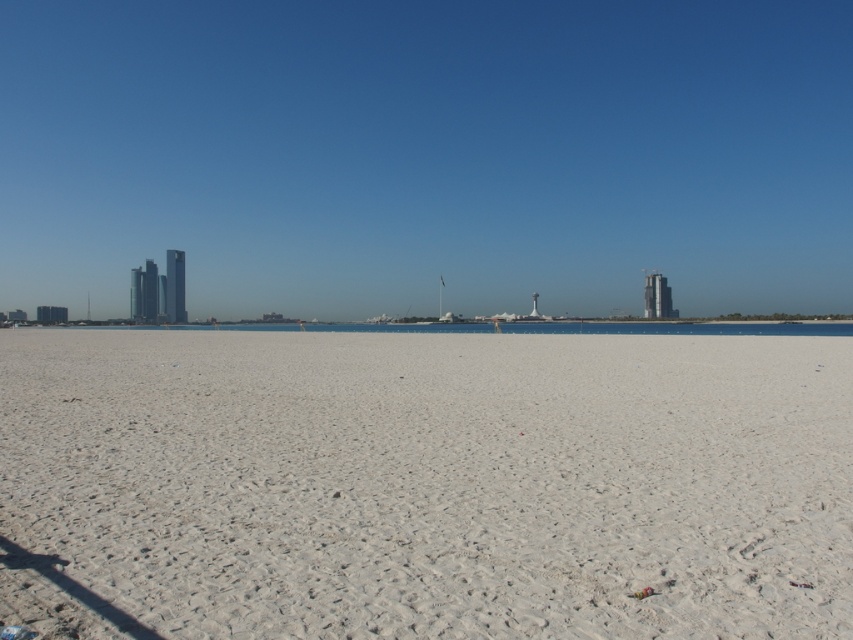
You are standing at the shoreline looking out at the scene. Which of the two areas, the white sandy beach at center or the clear blue water at center, extends higher up in the image?

The clear blue water at center extends higher up in the image because it is taller than the white sandy beach at center.

Based on the photo, you are standing on the white sandy beach at center and want to reach the clear blue water at center. Which direction should you move in?

Since the white sandy beach at center is located below the clear blue water at center, you should move upwards to reach the clear blue water at center from the white sandy beach at center.

From the picture: What are the coordinates of the white sandy beach at center?

The white sandy beach at center is located at coordinates point (427,483).